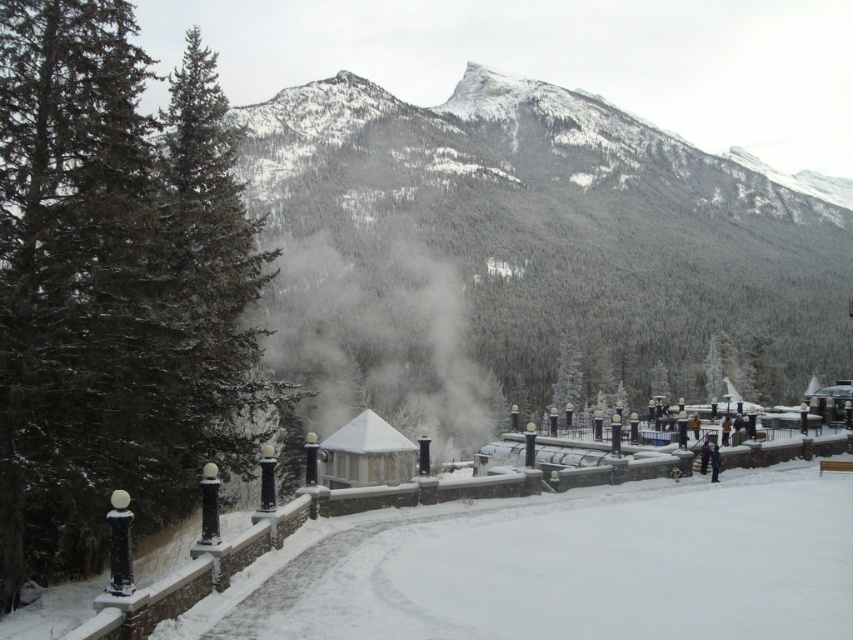
You are standing at the point with coordinates point (268, 236) and want to walk to the gazebo or pavilion located near the tall evergreen trees. There is a snow path between you and the gazebo. Is the point with coordinates point (51, 499) on your path towards the gazebo?

Yes, the point (51, 499) is on your path towards the gazebo because it is in front of point (268, 236), which is your starting position.

You are standing on the snow covered pathway and want to walk towards the green matte tree at left and the snowy forested mountain at upper center. Which object is closer to you?

The green matte tree at left is closer to you because it is positioned under the snowy forested mountain at upper center, indicating it is in front of the mountain from your perspective.